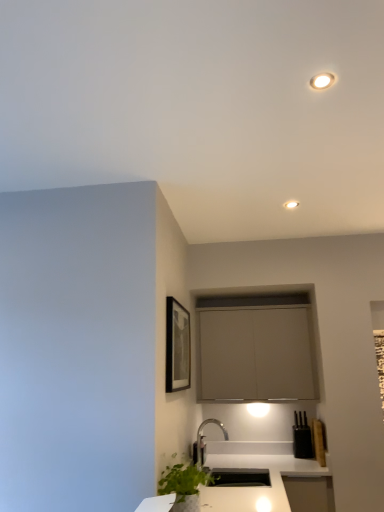
Question: Can you confirm if matte white recessed light at upper center is smaller than matte gray cabinet at center?

Choices:
 (A) no
 (B) yes

Answer: (B)

Question: Does matte white recessed light at upper center lie in front of matte gray cabinet at center?

Choices:
 (A) yes
 (B) no

Answer: (A)

Question: Is the surface of matte white recessed light at upper center in direct contact with matte gray cabinet at center?

Choices:
 (A) yes
 (B) no

Answer: (B)

Question: Is matte white recessed light at upper center shorter than matte gray cabinet at center?

Choices:
 (A) yes
 (B) no

Answer: (A)

Question: Does matte white recessed light at upper center appear on the left side of matte gray cabinet at center?

Choices:
 (A) yes
 (B) no

Answer: (B)

Question: Does point (291, 206) appear closer or farther from the camera than point (309, 486)?

Choices:
 (A) closer
 (B) farther

Answer: (A)

Question: Is matte white recessed light at upper center taller or shorter than white glossy countertop at lower center?

Choices:
 (A) short
 (B) tall

Answer: (A)

Question: From the image's perspective, is matte white recessed light at upper center located above or below white glossy countertop at lower center?

Choices:
 (A) above
 (B) below

Answer: (A)

Question: From a real-world perspective, relative to white glossy countertop at lower center, is matte white recessed light at upper center vertically above or below?

Choices:
 (A) below
 (B) above

Answer: (B)

Question: Relative to white glossy countertop at lower center, is matte gray cabinet at center in front or behind?

Choices:
 (A) front
 (B) behind

Answer: (B)

Question: Is matte gray cabinet at center to the left or to the right of white glossy countertop at lower center in the image?

Choices:
 (A) right
 (B) left

Answer: (A)

Question: Considering the positions of matte gray cabinet at center and white glossy countertop at lower center in the image, is matte gray cabinet at center wider or thinner than white glossy countertop at lower center?

Choices:
 (A) wide
 (B) thin

Answer: (B)

Question: Does point (306, 374) appear closer or farther from the camera than point (263, 445)?

Choices:
 (A) farther
 (B) closer

Answer: (B)

Question: In terms of width, does white glossy countertop at lower center look wider or thinner when compared to matte white recessed light at upper center?

Choices:
 (A) wide
 (B) thin

Answer: (A)

Question: Choose the correct answer: Is white glossy countertop at lower center inside matte white recessed light at upper center or outside it?

Choices:
 (A) inside
 (B) outside

Answer: (B)